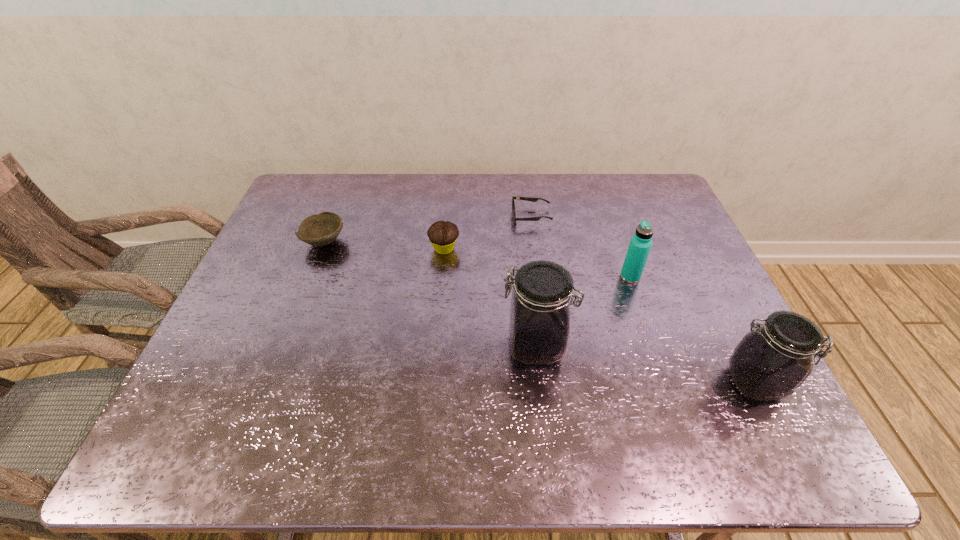
The width and height of the screenshot is (960, 540). In order to click on vacant position located on the back of the fifth object from right to left in this screenshot , I will do `click(449, 193)`.

At what (x,y) coordinates should I click in order to perform the action: click on object that is at the far edge. Please return your answer as a coordinate pair (x, y). Image resolution: width=960 pixels, height=540 pixels. Looking at the image, I should click on (531, 199).

Where is `object that is positioned at the near edge`? The width and height of the screenshot is (960, 540). object that is positioned at the near edge is located at coordinates (771, 362).

The height and width of the screenshot is (540, 960). In order to click on object located in the left edge section of the desktop in this screenshot , I will do `click(320, 229)`.

Identify the location of object that is positioned at the right edge. (771, 362).

Where is `object that is positioned at the near right corner`? The image size is (960, 540). object that is positioned at the near right corner is located at coordinates (771, 362).

Identify the location of free spot at the far edge of the desktop. (492, 206).

This screenshot has width=960, height=540. In the image, there is a desktop. Identify the location of vacant space at the near edge. (494, 381).

Locate an element on the screen. vacant space at the left edge of the desktop is located at coordinates click(x=278, y=340).

The width and height of the screenshot is (960, 540). In the image, there is a desktop. What are the coordinates of `free space at the right edge` in the screenshot? It's located at (672, 254).